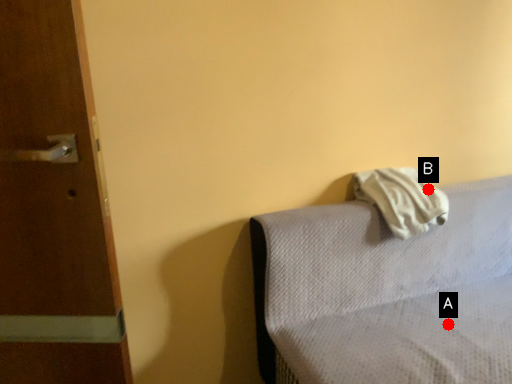
Question: Two points are circled on the image, labeled by A and B beside each circle. Which point is closer to the camera?

Choices:
 (A) A is closer
 (B) B is closer

Answer: (A)